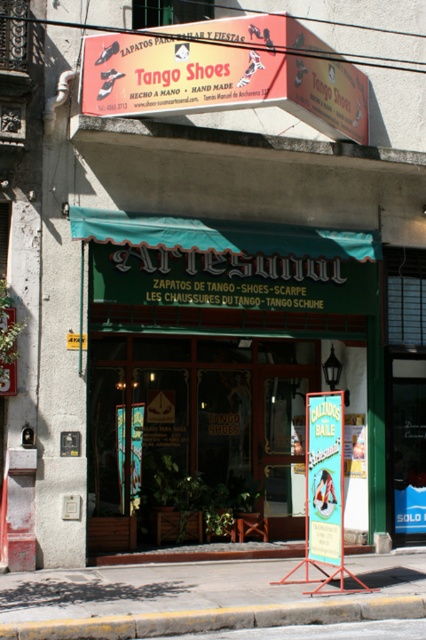
Who is taller, red plastic signboard at upper center or yellow concrete curb at lower center?

red plastic signboard at upper center is taller.

Between point (89, 60) and point (25, 621), which one is positioned in front?

Point (25, 621)

This screenshot has width=426, height=640. Find the location of `red plastic signboard at upper center`. red plastic signboard at upper center is located at coordinates click(226, 74).

Is red plastic signboard at upper center further to the viewer compared to green fabric sign at center?

Yes, red plastic signboard at upper center is behind green fabric sign at center.

Is point (190, 40) positioned behind point (328, 554)?

That is True.

Locate an element on the screen. The image size is (426, 640). red plastic signboard at upper center is located at coordinates (226, 74).

Does green wooden sign at center have a larger size compared to yellow concrete curb at lower center?

Yes.

Does green wooden sign at center have a lesser width compared to yellow concrete curb at lower center?

Yes.

Where is `green wooden sign at center`? The width and height of the screenshot is (426, 640). green wooden sign at center is located at coordinates (222, 368).